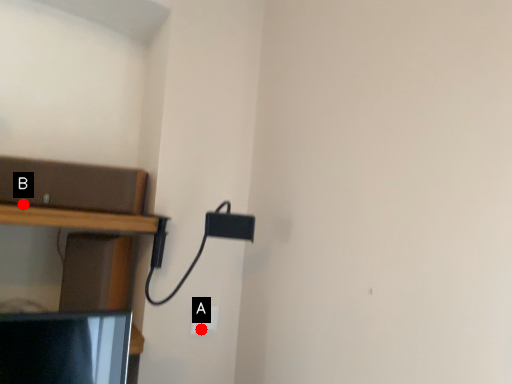
Question: Two points are circled on the image, labeled by A and B beside each circle. Among these points, which one is nearest to the camera?

Choices:
 (A) A is closer
 (B) B is closer

Answer: (B)